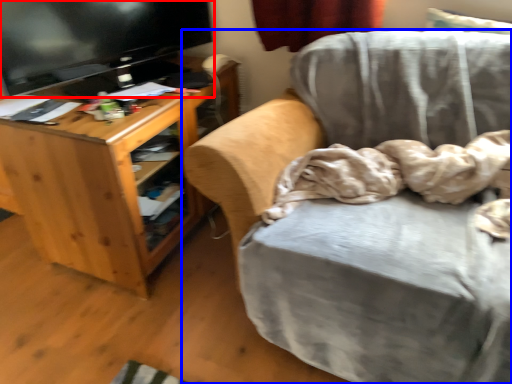
Question: Which object is further to the camera taking this photo, television (highlighted by a red box) or chair (highlighted by a blue box)?

Choices:
 (A) television
 (B) chair

Answer: (A)